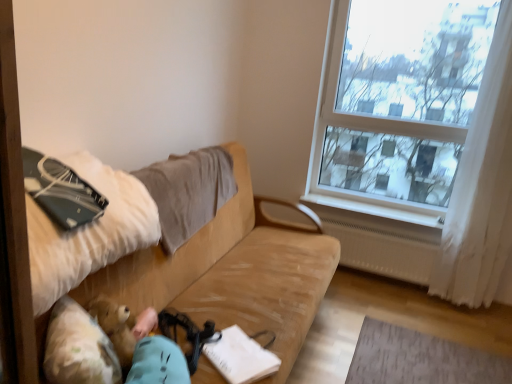
The width and height of the screenshot is (512, 384). I want to click on free space above white plastic radiator at lower right (from a real-world perspective), so click(364, 203).